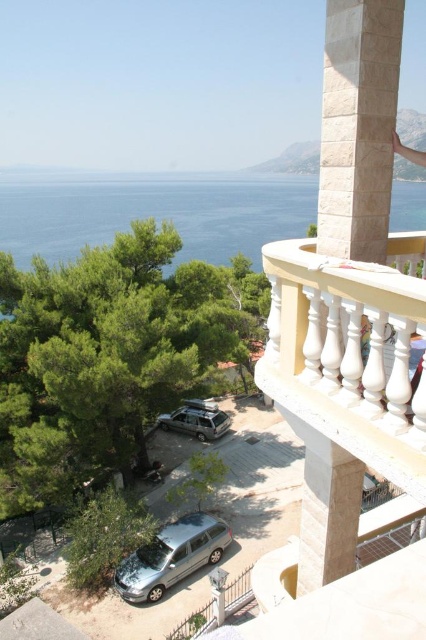
Question: Which is nearer to the metallic silver railing at lower center?

Choices:
 (A) beige stone column at upper right
 (B) blue water at upper center
 (C) satin silver suv at lower center
 (D) white marble balustrade at right

Answer: (D)

Question: Can you confirm if white marble balustrade at right is positioned above metallic silver railing at lower center?

Choices:
 (A) yes
 (B) no

Answer: (A)

Question: Does silver metallic car at lower center have a lesser width compared to metallic silver railing at lower center?

Choices:
 (A) no
 (B) yes

Answer: (A)

Question: Among these objects, which one is nearest to the camera?

Choices:
 (A) metallic silver railing at lower center
 (B) beige stone column at upper right

Answer: (B)

Question: Is white marble balustrade at right below satin silver suv at lower center?

Choices:
 (A) no
 (B) yes

Answer: (A)

Question: Which is nearer to the satin silver suv at lower center?

Choices:
 (A) white marble balustrade at right
 (B) beige stone column at upper right
 (C) metallic silver railing at lower center

Answer: (C)